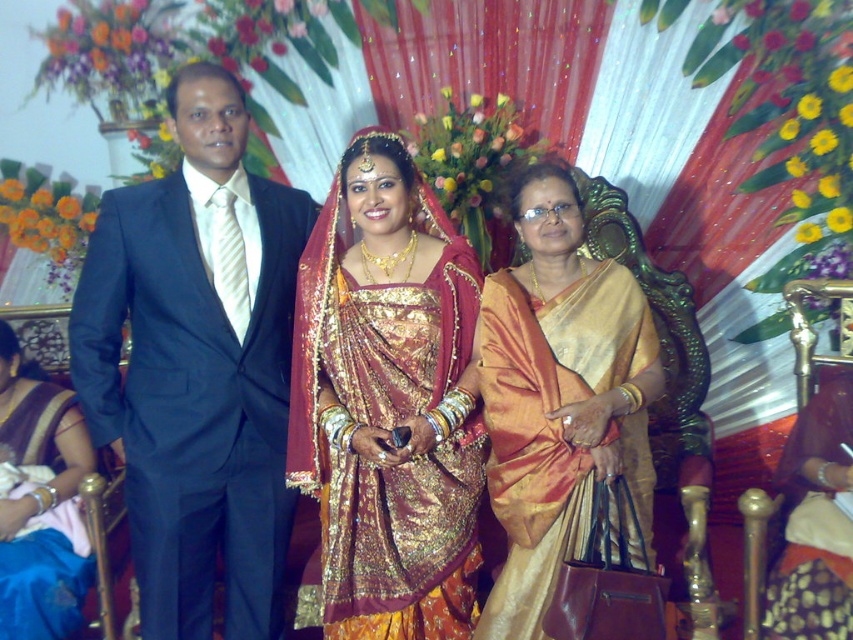
Is shiny black suit at left to the left of matte black suit at left from the viewer's perspective?

Yes, shiny black suit at left is to the left of matte black suit at left.

Locate an element on the screen. This screenshot has height=640, width=853. shiny black suit at left is located at coordinates (196, 365).

Identify the location of shiny black suit at left. The image size is (853, 640). (196, 365).

This screenshot has height=640, width=853. Identify the location of shiny black suit at left. (196, 365).

Between point (161, 337) and point (16, 499), which one is positioned in front?

Point (161, 337) is in front.

Locate an element on the screen. The image size is (853, 640). shiny black suit at left is located at coordinates (196, 365).

Between point (248, 508) and point (38, 412), which one is positioned in front?

Point (248, 508) is in front.

The image size is (853, 640). Find the location of `shiny black suit at left`. shiny black suit at left is located at coordinates (196, 365).

Between shiny silk saree at center and silky gold sari at center, which one has more height?

shiny silk saree at center

Is shiny silk saree at center above silky gold sari at center?

Yes, shiny silk saree at center is above silky gold sari at center.

Is point (352, 552) in front of point (514, 602)?

No.

Find the location of a particular element. Image resolution: width=853 pixels, height=640 pixels. shiny silk saree at center is located at coordinates (387, 403).